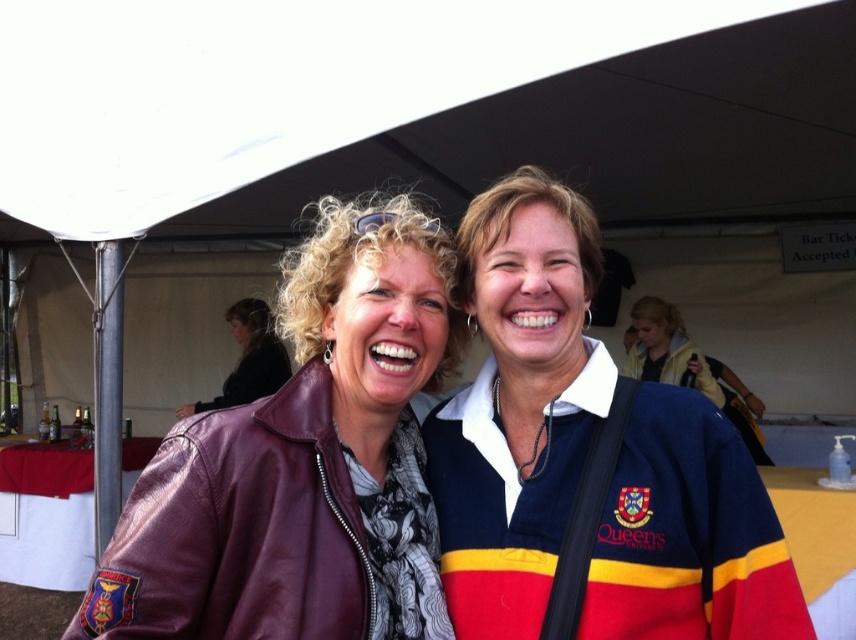
You are standing at the entrance of the tent and want to take a photo of the white fabric canopy at upper center and the matte leather jacket at center. Which object should you focus on first to ensure both are in focus?

The white fabric canopy at upper center is closer to you, so focus on it first to ensure both objects are in focus.

You are standing at the entrance of the tent and want to find the navy blue jersey at center. Which direction should you move to locate it?

The navy blue jersey at center is located at coordinates point (587, 461), so you should move towards the center of the tent to find it.

You are planning to hang a small decoration from the white fabric canopy at upper center. The decoration requires at least 10 cm of space above it to avoid touching the matte leather jacket at center. Is there enough vertical space between them?

The white fabric canopy at upper center has a greater height compared to the matte leather jacket at center, so there is sufficient vertical space to hang the decoration without it touching the matte leather jacket at center.